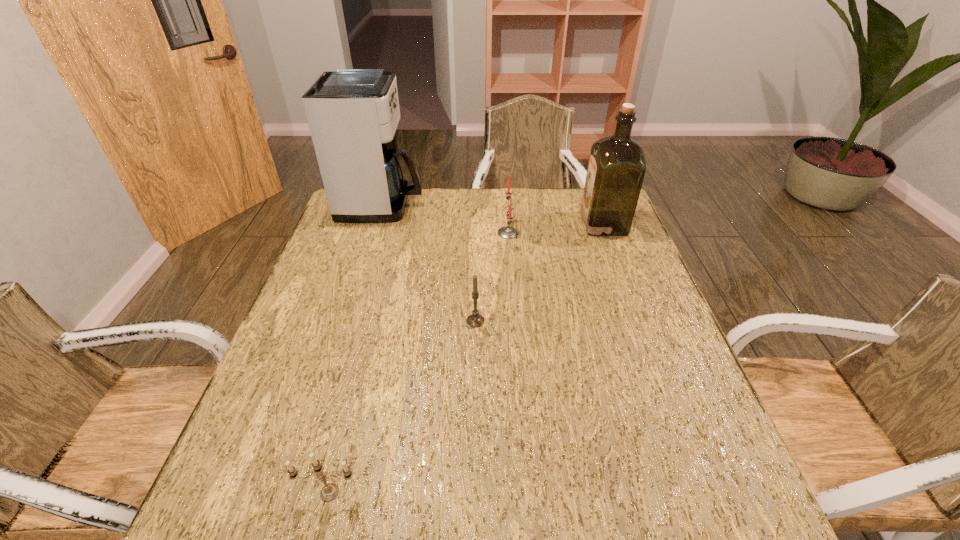
You are a GUI agent. You are given a task and a screenshot of the screen. Output one action in this format:
    pyautogui.click(x=<x>, y=<y>)
    Task: Click on the free location located on the label of the rightmost object
    
    Given the screenshot: What is the action you would take?
    pyautogui.click(x=529, y=224)

Identify the location of vacant area situated 0.140m on the label of the rightmost object. This screenshot has height=540, width=960. (539, 224).

Where is `free spot located 0.210m on the front-facing side of the rightmost candle`? The image size is (960, 540). free spot located 0.210m on the front-facing side of the rightmost candle is located at coordinates (430, 233).

Identify the location of vacant space located on the front-facing side of the rightmost candle. The width and height of the screenshot is (960, 540). (391, 233).

In order to click on vacant area situated on the front-facing side of the rightmost candle in this screenshot , I will do `click(381, 233)`.

Image resolution: width=960 pixels, height=540 pixels. Identify the location of vacant space situated 0.160m on the front of the third object from left to right. (475, 383).

Image resolution: width=960 pixels, height=540 pixels. I want to click on vacant space located on the right of the nearest object, so click(x=555, y=492).

Locate an element on the screen. The height and width of the screenshot is (540, 960). coffee maker at the far edge is located at coordinates (353, 114).

This screenshot has height=540, width=960. What are the coordinates of `liquor located in the far edge section of the desktop` in the screenshot? It's located at (616, 169).

The width and height of the screenshot is (960, 540). I want to click on candle present at the far edge, so click(507, 232).